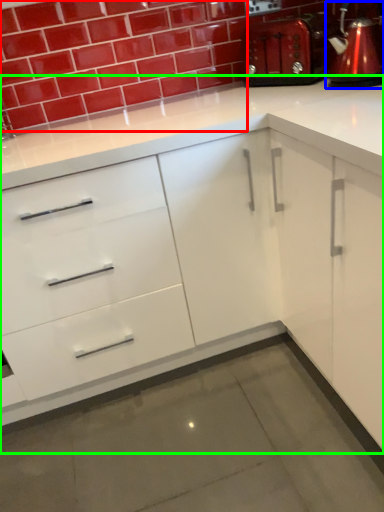
Question: Which object is positioned farthest from brick (highlighted by a red box)? Select from coffeepot (highlighted by a blue box) and cabinetry (highlighted by a green box).

Choices:
 (A) coffeepot
 (B) cabinetry

Answer: (B)